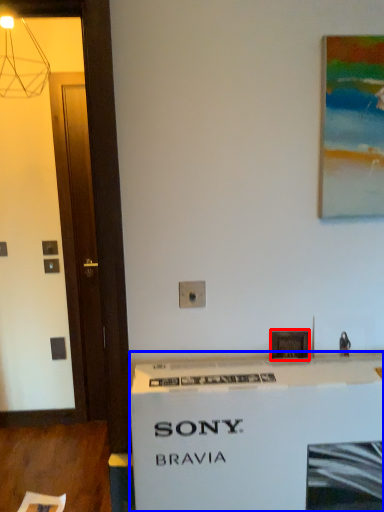
Question: Which object is closer to the camera taking this photo, picture frame (highlighted by a red box) or counter (highlighted by a blue box)?

Choices:
 (A) picture frame
 (B) counter

Answer: (B)